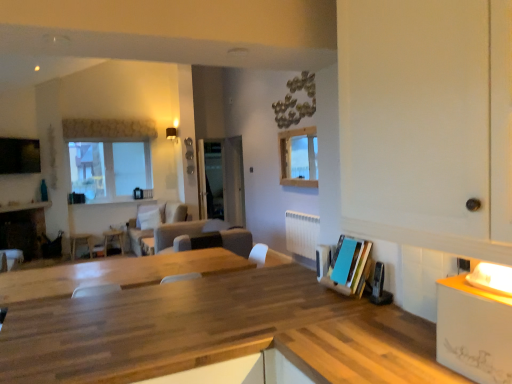
Question: Would you say suede-like gray couch at center, which appears as the second couch when viewed from the back, is to the left or to the right of matte black fireplace at left in the picture?

Choices:
 (A) right
 (B) left

Answer: (A)

Question: Is suede-like gray couch at center, which appears as the second couch when viewed from the back, in front of or behind matte black fireplace at left in the image?

Choices:
 (A) front
 (B) behind

Answer: (A)

Question: Based on their relative distances, which object is nearer to the white plastic radiator at center?

Choices:
 (A) suede-like gray couch at center, arranged as the first couch when viewed from the front
 (B) matte white chair at lower left
 (C) white glossy counter at right
 (D) suede beige couch at center, the 1th couch from the back
 (E) wooden table at center

Answer: (A)

Question: Which of these objects is positioned closest to the wooden table at center?

Choices:
 (A) transparent glass door at center
 (B) suede beige couch at center, arranged as the second couch when viewed from the front
 (C) suede-like gray couch at center, arranged as the first couch when viewed from the front
 (D) white plastic radiator at center
 (E) white glossy counter at right

Answer: (B)